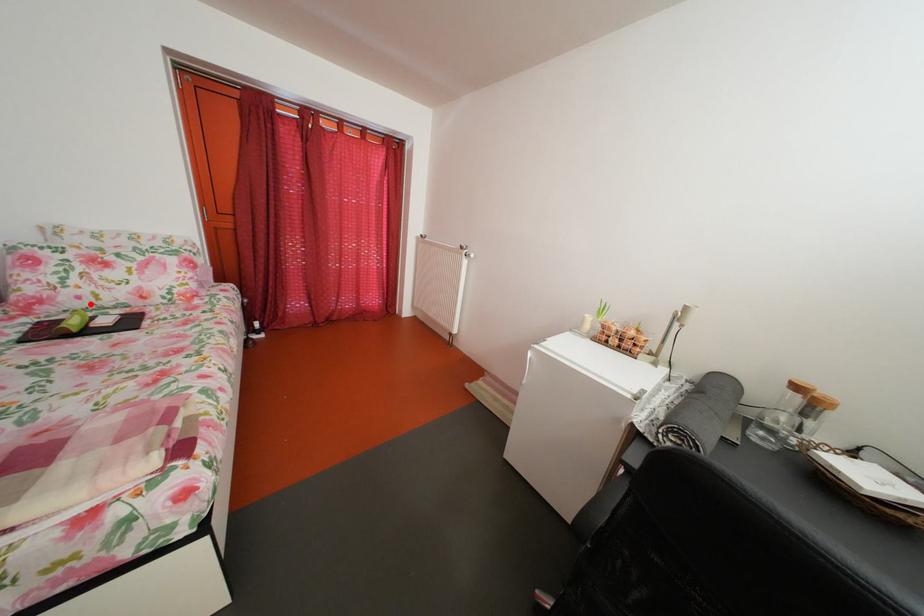
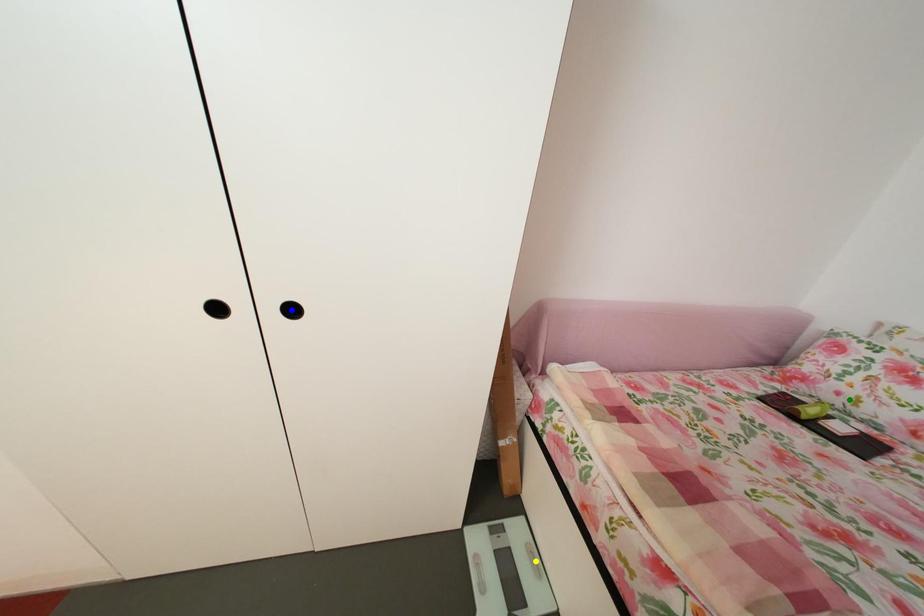
Question: I am providing you with two images of the same scene from different viewpoints. A red point is marked on the first image. You are given multiple points on the second image. Which point in image 2 represents the same 3d spot as the red point in image 1?

Choices:
 (A) green point
 (B) yellow point
 (C) blue point

Answer: (A)